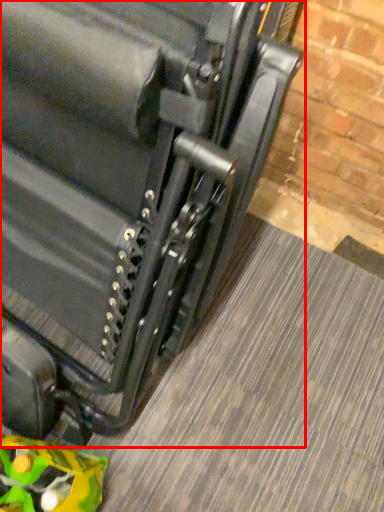
Question: From the image, what is the correct spatial relationship of suitcase (annotated by the red box) in relation to toy?

Choices:
 (A) right
 (B) left

Answer: (A)